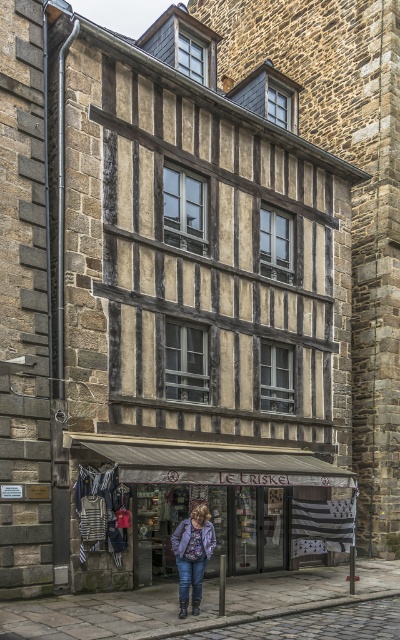
Question: Does white canvas awning at lower center lie in front of denim jacket at center?

Choices:
 (A) yes
 (B) no

Answer: (B)

Question: Is matte gray awning at center bigger than denim jacket at center?

Choices:
 (A) yes
 (B) no

Answer: (B)

Question: Among these objects, which one is farthest from the camera?

Choices:
 (A) white canvas awning at lower center
 (B) matte gray awning at center

Answer: (B)

Question: Does white canvas awning at lower center lie in front of denim jacket at center?

Choices:
 (A) yes
 (B) no

Answer: (B)

Question: Which of the following is the closest to the observer?

Choices:
 (A) (212, 518)
 (B) (192, 561)
 (C) (133, 442)

Answer: (B)

Question: Which object appears farthest from the camera in this image?

Choices:
 (A) denim jacket at center
 (B) matte gray awning at center
 (C) white canvas awning at lower center

Answer: (B)